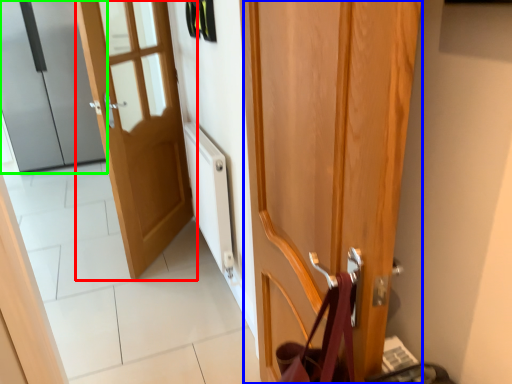
Question: Which object is positioned closest to door (highlighted by a red box)? Select from door (highlighted by a blue box) and door (highlighted by a green box).

Choices:
 (A) door
 (B) door

Answer: (A)